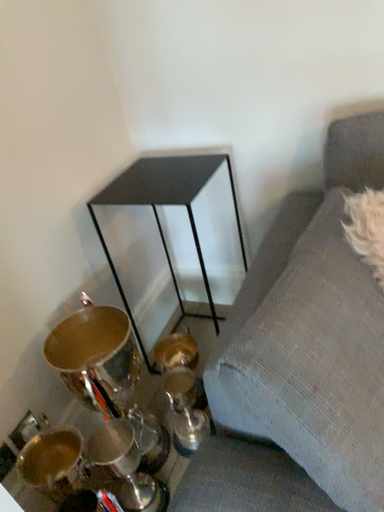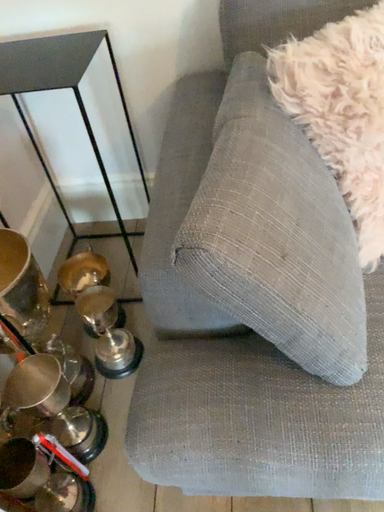
Question: Which way did the camera rotate in the video?

Choices:
 (A) rotated upward
 (B) rotated downward

Answer: (B)